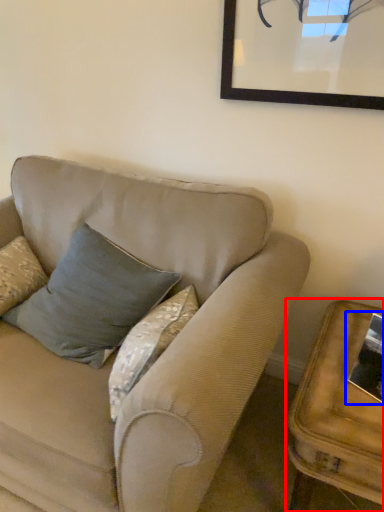
Question: Among these objects, which one is farthest to the camera, table (highlighted by a red box) or picture frame (highlighted by a blue box)?

Choices:
 (A) table
 (B) picture frame

Answer: (B)